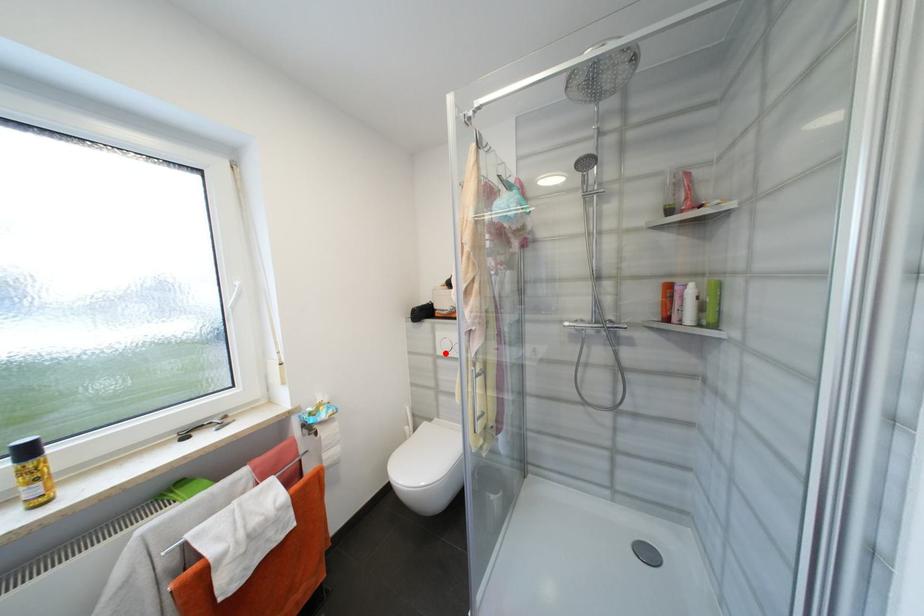
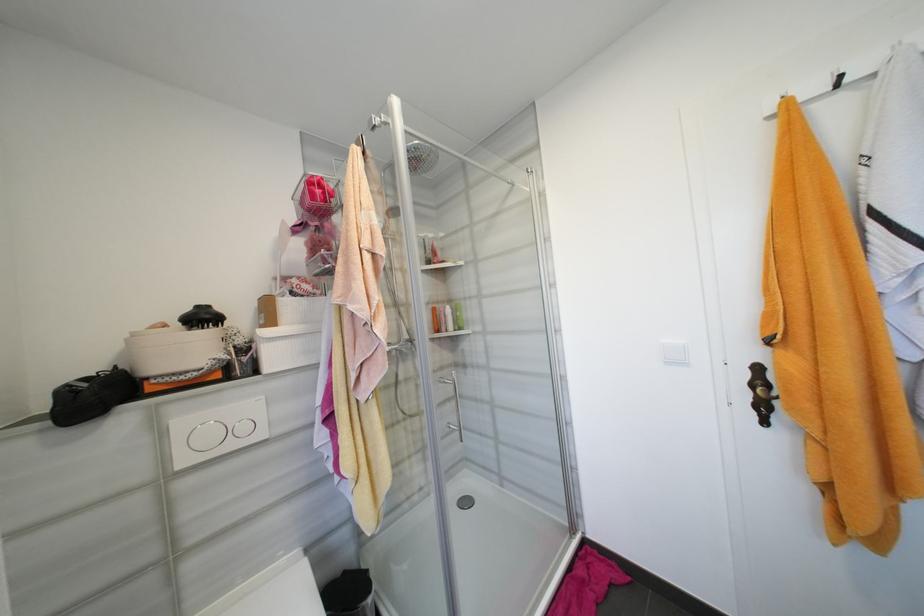
Question: I am providing you with two images of the same scene from different viewpoints. A red point is marked on the first image. Can you still see the location of the red point in image 2?

Choices:
 (A) Yes
 (B) No

Answer: (A)